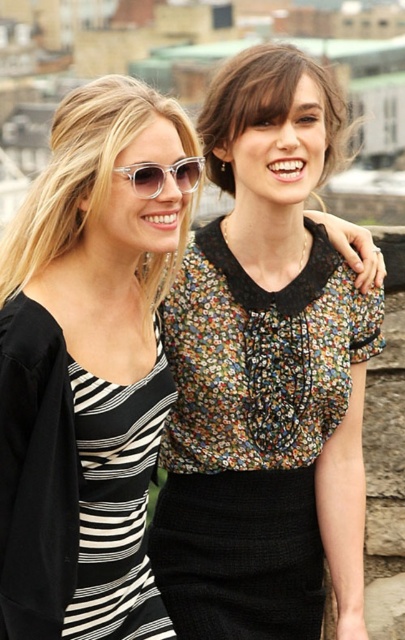
You are taking a photo of two people standing in front of a city skyline. You notice two specific points in the image labeled as point [4,467] and point [168,168]. Which point is closer to the camera?

Point [4,467] is in front of point [168,168], so it is closer to the camera.

You are a fashion designer observing two floral fabric blouses in the image. The first is the floral fabric blouse at center, and the second is the floral fabric blouse at upper center. Which blouse has a smaller width?

The floral fabric blouse at center has a smaller width compared to the floral fabric blouse at upper center.

You are a fashion designer analyzing the image. You need to identify where a specific coordinate point falls on the clothing items. The point is located at coordinates point [266,106]. Which clothing item does this point belong to?

The point [266,106] is on the floral fabric blouse at upper center.